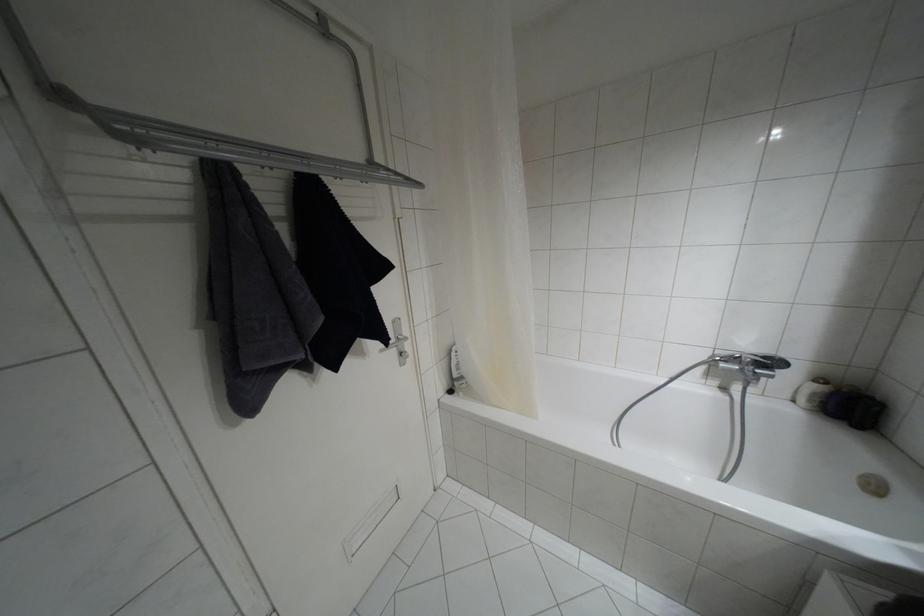
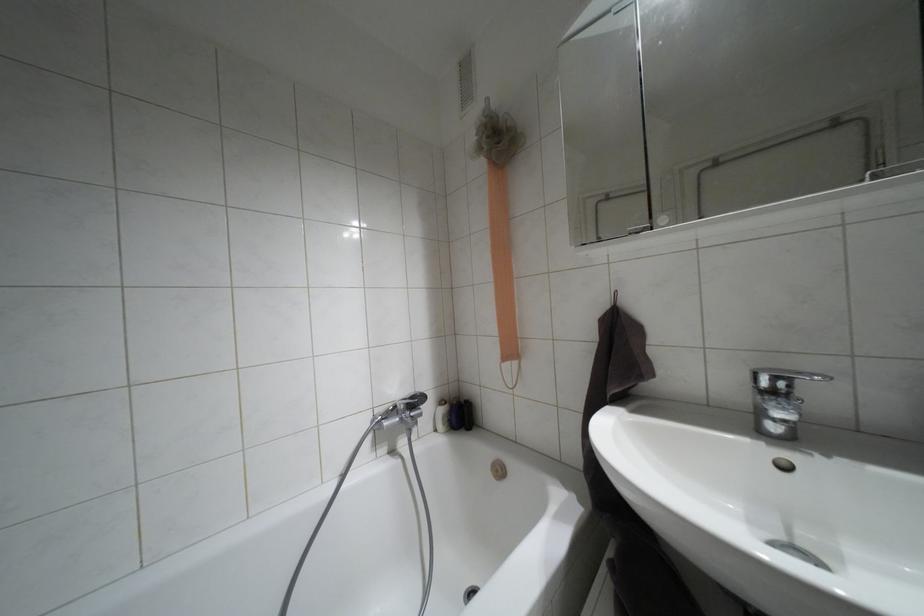
Question: The first image is from the beginning of the video and the second image is from the end. How did the camera likely rotate when shooting the video?

Choices:
 (A) Left
 (B) Right
 (C) Up
 (D) Down

Answer: (B)